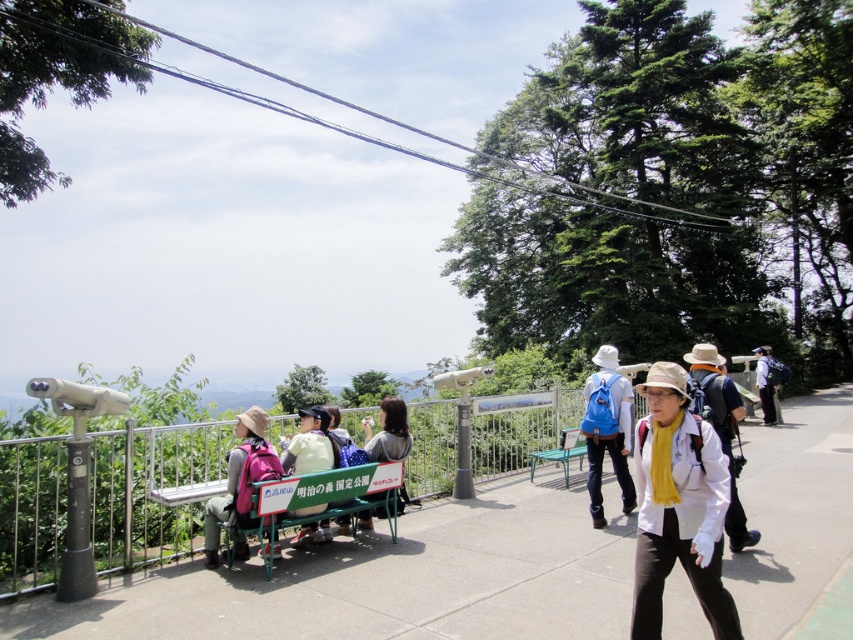
Can you confirm if matte black jacket at center is positioned above blue fabric backpack at center-right?

Indeed, matte black jacket at center is positioned over blue fabric backpack at center-right.

Is matte black jacket at center below blue fabric backpack at center-right?

Actually, matte black jacket at center is above blue fabric backpack at center-right.

Locate an element on the screen. matte black jacket at center is located at coordinates (387, 433).

This screenshot has width=853, height=640. Identify the location of matte black jacket at center. (387, 433).

Based on the photo, does gray concrete pavement at center appear over light green plastic bench at center?

Actually, gray concrete pavement at center is below light green plastic bench at center.

Is point (471, 621) in front of point (286, 452)?

That is True.

Image resolution: width=853 pixels, height=640 pixels. I want to click on gray concrete pavement at center, so click(x=386, y=580).

Can you confirm if gray concrete pavement at center is wider than matte black jacket at center?

Yes.

How far apart are gray concrete pavement at center and matte black jacket at center?

They are 11.50 feet apart.

What do you see at coordinates (386, 580) in the screenshot? I see `gray concrete pavement at center` at bounding box center [386, 580].

Find the location of `gray concrete pavement at center`. gray concrete pavement at center is located at coordinates (386, 580).